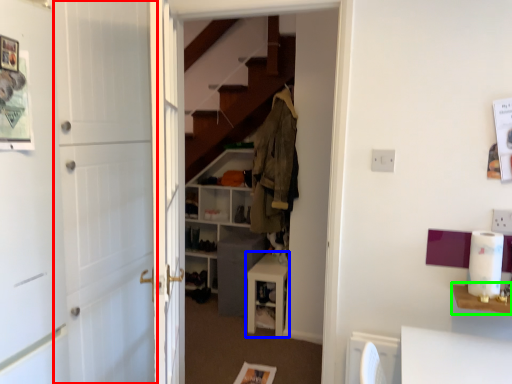
Question: Based on their relative distances, which object is farther from barn door (highlighted by a red box)? Choose from furniture (highlighted by a blue box) and table (highlighted by a green box).

Choices:
 (A) furniture
 (B) table

Answer: (B)